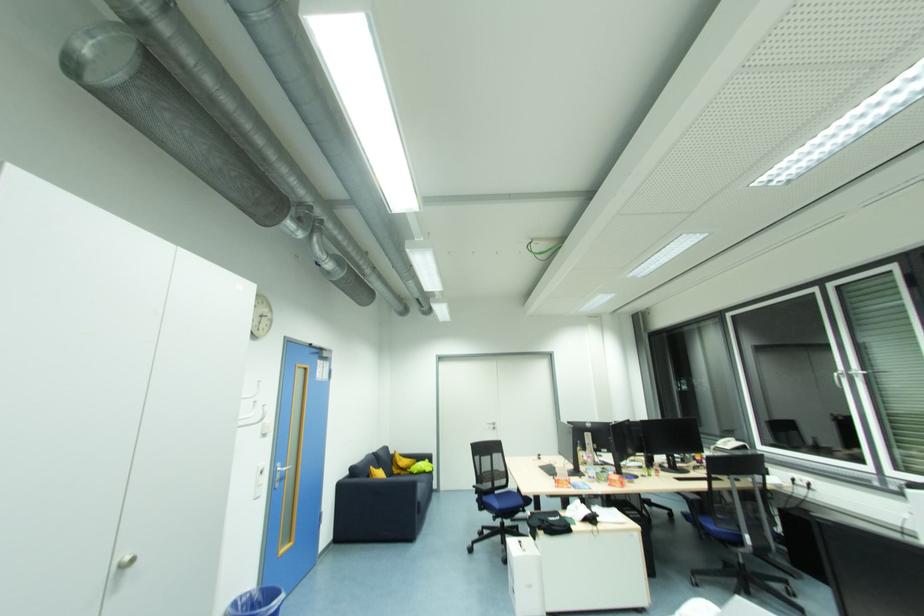
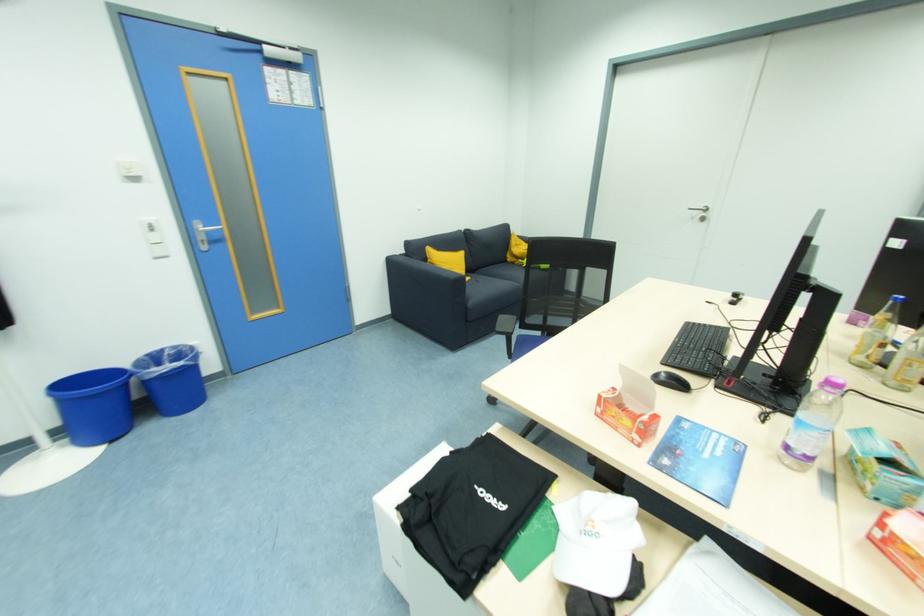
Where in the second image is the point corresponding to point 496,430 from the first image?

(706, 221)